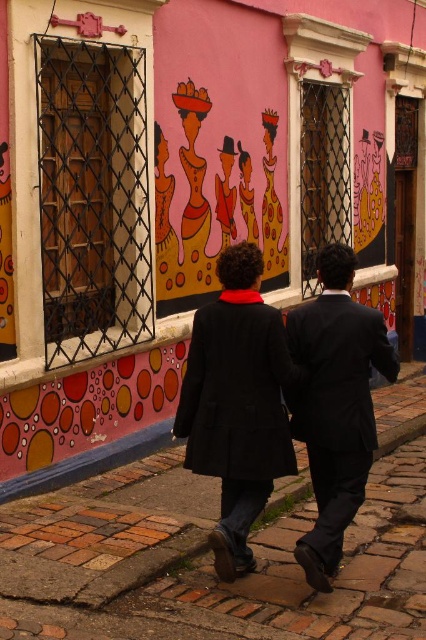
Question: Which of the following is the closest to the observer?

Choices:
 (A) dark blue suit at center
 (B) matte pink dress at center

Answer: (A)

Question: Does matte black coat at center have a greater width compared to matte pink dress at center?

Choices:
 (A) yes
 (B) no

Answer: (A)

Question: Which point is farther to the camera?

Choices:
 (A) tap(221, 577)
 (B) tap(189, 115)
 (C) tap(293, 422)
 (D) tap(250, 172)

Answer: (D)

Question: Does dark blue suit at center appear on the left side of matte pink painting of women at center?

Choices:
 (A) yes
 (B) no

Answer: (B)

Question: Does dark blue suit at center appear under matte pink dress at center?

Choices:
 (A) no
 (B) yes

Answer: (B)

Question: Among these points, which one is nearest to the camera?

Choices:
 (A) (299, 332)
 (B) (198, 248)
 (C) (249, 230)
 (D) (275, 465)

Answer: (D)